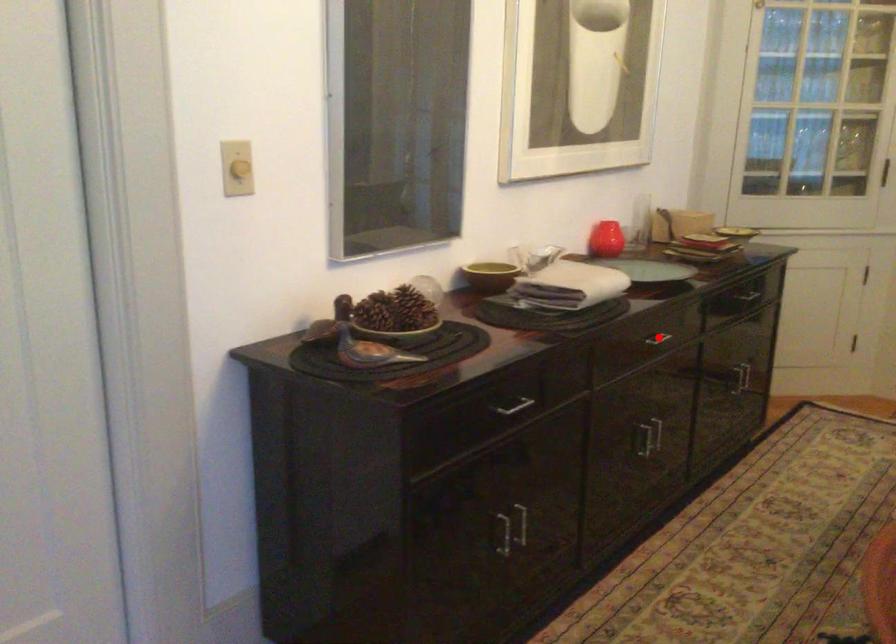
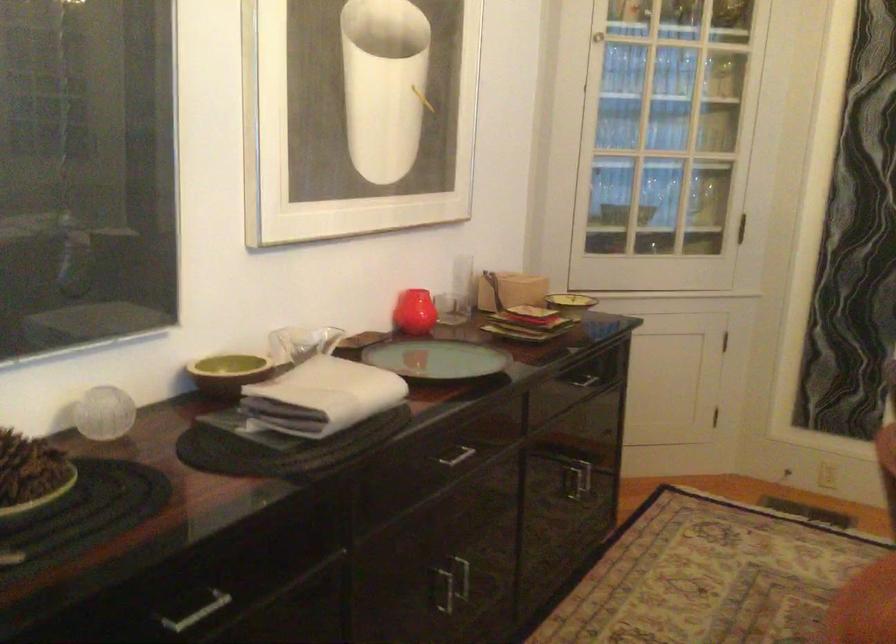
Where in the second image is the point corresponding to the highlighted location from the first image?

(453, 455)